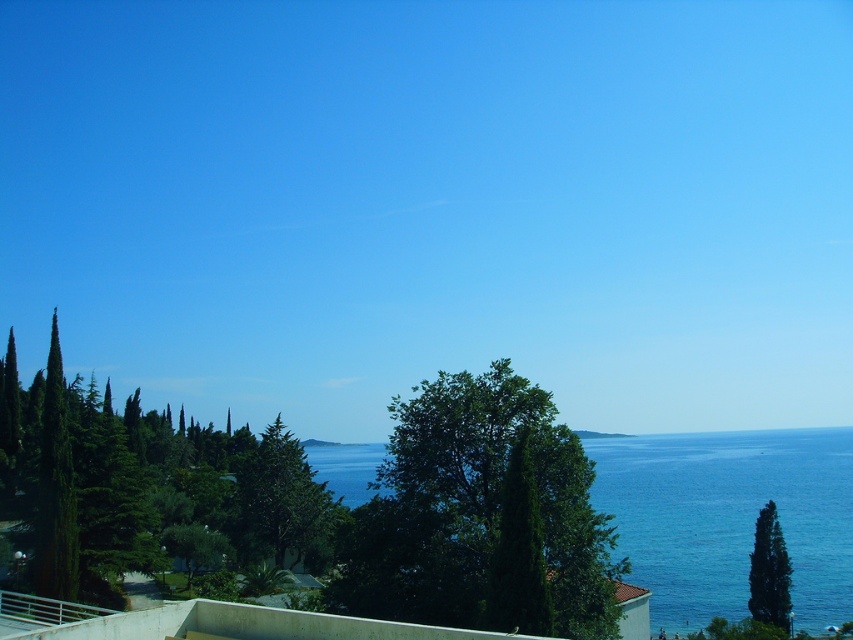
Question: Which object is the farthest from the green textured cypress tree at center?

Choices:
 (A) green glossy cypress tree at lower right
 (B) blue liquid water at center

Answer: (B)

Question: Which object is farther from the camera taking this photo?

Choices:
 (A) blue liquid water at center
 (B) green textured cypress tree at center

Answer: (A)

Question: Does green textured cypress tree at center lie in front of green glossy cypress tree at lower right?

Choices:
 (A) yes
 (B) no

Answer: (A)

Question: Which of the following is the closest to the observer?

Choices:
 (A) (252, 464)
 (B) (512, 545)
 (C) (563, 440)
 (D) (694, 436)

Answer: (B)

Question: Is blue liquid water at center bigger than green matte cypress tree at center?

Choices:
 (A) yes
 (B) no

Answer: (A)

Question: Is green textured cypress tree at center wider than blue liquid water at center?

Choices:
 (A) yes
 (B) no

Answer: (B)